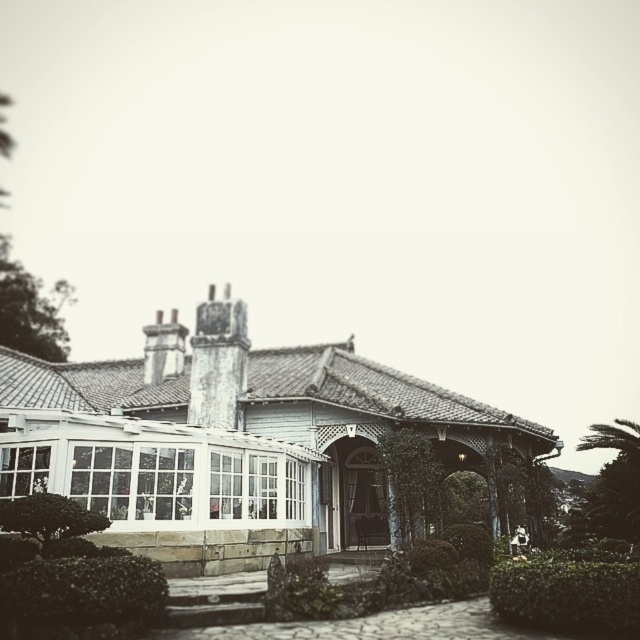
Measure the distance between white glass conservatory at center and camera.

They are 106.79 feet apart.

Can you confirm if white glass conservatory at center is positioned to the right of green leafy hedge at lower left?

Yes, white glass conservatory at center is to the right of green leafy hedge at lower left.

Is point (371, 464) positioned before point (145, 625)?

No, (371, 464) is further to viewer.

The height and width of the screenshot is (640, 640). I want to click on white glass conservatory at center, so click(x=275, y=403).

Does white glass conservatory at center have a smaller size compared to green leafy hedge at lower right?

No, white glass conservatory at center is not smaller than green leafy hedge at lower right.

Does white glass conservatory at center appear on the left side of green leafy hedge at lower right?

Yes, white glass conservatory at center is to the left of green leafy hedge at lower right.

Is point (176, 362) more distant than point (602, 634)?

Yes, point (176, 362) is behind point (602, 634).

At what (x,y) coordinates should I click in order to perform the action: click on white glass conservatory at center. Please return your answer as a coordinate pair (x, y). The width and height of the screenshot is (640, 640). Looking at the image, I should click on (275, 403).

Between green leafy hedge at lower left and green leafy hedge at lower right, which one is positioned lower?

Positioned lower is green leafy hedge at lower right.

Does green leafy hedge at lower left have a greater width compared to green leafy hedge at lower right?

In fact, green leafy hedge at lower left might be narrower than green leafy hedge at lower right.

Is point (132, 628) less distant than point (513, 582)?

Yes, it is in front of point (513, 582).

Where is `green leafy hedge at lower left`? This screenshot has height=640, width=640. green leafy hedge at lower left is located at coordinates (81, 596).